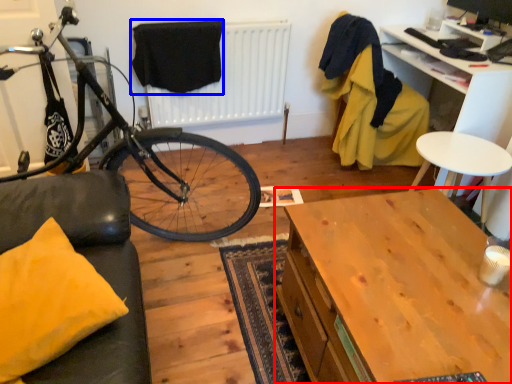
Question: Which of the following is the closest to the observer, desk (highlighted by a red box) or clothe (highlighted by a blue box)?

Choices:
 (A) desk
 (B) clothe

Answer: (A)